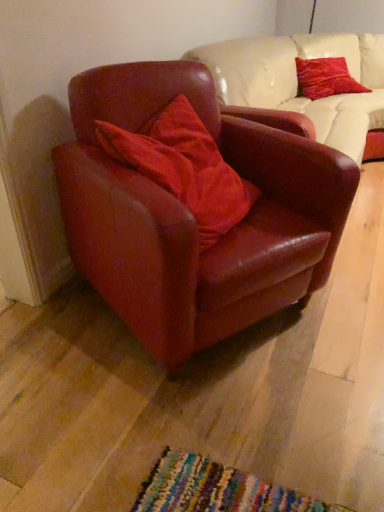
Image resolution: width=384 pixels, height=512 pixels. Describe the element at coordinates (184, 167) in the screenshot. I see `satin red pillow at center, which is the 1th pillow in bottom-to-top order` at that location.

Consider the image. Measure the distance between point (289, 262) and camera.

The depth of point (289, 262) is 4.44 feet.

At what (x,y) coordinates should I click in order to perform the action: click on velvet red pillow at upper right, arranged as the first pillow when viewed from the top. Please return your answer as a coordinate pair (x, y). Image resolution: width=384 pixels, height=512 pixels. Looking at the image, I should click on (325, 78).

How many degrees apart are the facing directions of velvet red pillow at upper right, the 2th pillow in the left-to-right sequence, and satin burgundy armchair at center?

17.9 degrees separate the facing orientations of velvet red pillow at upper right, the 2th pillow in the left-to-right sequence, and satin burgundy armchair at center.

Which of these two, velvet red pillow at upper right, arranged as the 1th pillow when viewed from the right, or satin burgundy armchair at center, is wider?

satin burgundy armchair at center.

From a real-world perspective, who is located higher, velvet red pillow at upper right, placed as the second pillow when sorted from bottom to top, or satin burgundy armchair at center?

velvet red pillow at upper right, placed as the second pillow when sorted from bottom to top, is physically above.

Based on the photo, which object is positioned more to the right, velvet red pillow at upper right, the second pillow in the front-to-back sequence, or satin burgundy armchair at center?

velvet red pillow at upper right, the second pillow in the front-to-back sequence.

From the image's perspective, which is above, velvet red pillow at upper right, the second pillow in the front-to-back sequence, or satin red pillow at center, which appears as the 2th pillow when viewed from the right?

From the image's view, velvet red pillow at upper right, the second pillow in the front-to-back sequence, is above.

Is velvet red pillow at upper right, the second pillow in the front-to-back sequence, oriented towards satin red pillow at center, the second pillow positioned from the back?

No, velvet red pillow at upper right, the second pillow in the front-to-back sequence, is not turned towards satin red pillow at center, the second pillow positioned from the back.

Which is more to the left, velvet red pillow at upper right, the 2th pillow in the left-to-right sequence, or satin red pillow at center, placed as the first pillow when sorted from left to right?

satin red pillow at center, placed as the first pillow when sorted from left to right, is more to the left.

Would you say velvet red pillow at upper right, the second pillow in the front-to-back sequence, is outside satin red pillow at center, which is the 1th pillow in bottom-to-top order?

That's correct, velvet red pillow at upper right, the second pillow in the front-to-back sequence, is outside of satin red pillow at center, which is the 1th pillow in bottom-to-top order.

Can you see satin red pillow at center, placed as the first pillow when sorted from left to right, touching satin burgundy armchair at center?

They are not placed beside each other.

Is point (222, 232) closer or farther from the camera than point (293, 206)?

Point (222, 232) is closer to the camera than point (293, 206).

Is satin red pillow at center, the second pillow viewed from the top, looking in the opposite direction of satin burgundy armchair at center?

That's right, satin red pillow at center, the second pillow viewed from the top, is facing away from satin burgundy armchair at center.

Considering the relative sizes of satin red pillow at center, which is the 1th pillow in bottom-to-top order, and satin burgundy armchair at center in the image provided, is satin red pillow at center, which is the 1th pillow in bottom-to-top order, thinner than satin burgundy armchair at center?

Yes, satin red pillow at center, which is the 1th pillow in bottom-to-top order, is thinner than satin burgundy armchair at center.

Looking at this image, considering the positions of objects satin burgundy armchair at center and velvet red pillow at upper right, arranged as the 1th pillow when viewed from the right, in the image provided, who is more to the left, satin burgundy armchair at center or velvet red pillow at upper right, arranged as the 1th pillow when viewed from the right,?

Positioned to the left is satin burgundy armchair at center.

Is satin burgundy armchair at center located outside velvet red pillow at upper right, the 1th pillow viewed from the back?

Yes, satin burgundy armchair at center is outside of velvet red pillow at upper right, the 1th pillow viewed from the back.

What's the angular difference between satin burgundy armchair at center and velvet red pillow at upper right, placed as the second pillow when sorted from bottom to top,'s facing directions?

The angle between the facing direction of satin burgundy armchair at center and the facing direction of velvet red pillow at upper right, placed as the second pillow when sorted from bottom to top, is 17.9 degrees.

In the scene shown: From the image's perspective, between satin burgundy armchair at center and satin red pillow at center, the second pillow viewed from the top, who is located below?

satin burgundy armchair at center, from the image's perspective.

Which object is thinner, satin burgundy armchair at center or satin red pillow at center, placed as the first pillow when sorted from left to right?

Thinner between the two is satin red pillow at center, placed as the first pillow when sorted from left to right.

Is satin burgundy armchair at center positioned with its back to satin red pillow at center, placed as the first pillow when sorted from left to right?

Result: Yes, satin burgundy armchair at center is facing away from satin red pillow at center, placed as the first pillow when sorted from left to right.

How many degrees apart are the facing directions of satin burgundy armchair at center and satin red pillow at center, which is the 1th pillow in front-to-back order?

The facing directions of satin burgundy armchair at center and satin red pillow at center, which is the 1th pillow in front-to-back order, are 19 degrees apart.

Is satin red pillow at center, placed as the first pillow when sorted from left to right, not inside velvet red pillow at upper right, the second pillow in the front-to-back sequence?

satin red pillow at center, placed as the first pillow when sorted from left to right, lies outside velvet red pillow at upper right, the second pillow in the front-to-back sequence,'s area.

Where is `pillow lying above the satin red pillow at center, placed as the first pillow when sorted from left to right (from the image's perspective)`? pillow lying above the satin red pillow at center, placed as the first pillow when sorted from left to right (from the image's perspective) is located at coordinates [325, 78].

From the image's perspective, which is below, satin red pillow at center, which is the 1th pillow in front-to-back order, or velvet red pillow at upper right, arranged as the first pillow when viewed from the top?

satin red pillow at center, which is the 1th pillow in front-to-back order.

Which object is more forward, satin red pillow at center, the second pillow viewed from the top, or velvet red pillow at upper right, the 2th pillow in the left-to-right sequence?

satin red pillow at center, the second pillow viewed from the top, is more forward.

You are a GUI agent. You are given a task and a screenshot of the screen. Output one action in this format:
    pyautogui.click(x=<x>, y=<y>)
    Task: Click on the 2nd pillow above the satin burgundy armchair at center (from the image's perspective)
    The height and width of the screenshot is (512, 384).
    Given the screenshot: What is the action you would take?
    pyautogui.click(x=325, y=78)

Locate an element on the screen. The image size is (384, 512). pillow below the satin red pillow at center, the second pillow viewed from the top (from a real-world perspective) is located at coordinates (325, 78).

From the image, which object appears to be nearer to satin red pillow at center, which is the 1th pillow in front-to-back order, satin burgundy armchair at center or velvet red pillow at upper right, arranged as the 1th pillow when viewed from the right?

Based on the image, satin burgundy armchair at center appears to be nearer to satin red pillow at center, which is the 1th pillow in front-to-back order.

Looking at the image, which one is located further to velvet red pillow at upper right, the second pillow in the front-to-back sequence, satin red pillow at center, which appears as the 2th pillow when viewed from the right, or satin burgundy armchair at center?

satin burgundy armchair at center is further to velvet red pillow at upper right, the second pillow in the front-to-back sequence.

From the image, which object appears to be nearer to velvet red pillow at upper right, placed as the second pillow when sorted from bottom to top, satin burgundy armchair at center or satin red pillow at center, the second pillow positioned from the back?

Based on the image, satin red pillow at center, the second pillow positioned from the back, appears to be nearer to velvet red pillow at upper right, placed as the second pillow when sorted from bottom to top.

Consider the image. From the image, which object appears to be nearer to satin burgundy armchair at center, velvet red pillow at upper right, the second pillow in the front-to-back sequence, or satin red pillow at center, which appears as the 2th pillow when viewed from the right?

The object closer to satin burgundy armchair at center is satin red pillow at center, which appears as the 2th pillow when viewed from the right.

Based on their spatial positions, is satin red pillow at center, the second pillow viewed from the top, or velvet red pillow at upper right, the second pillow in the front-to-back sequence, closer to satin burgundy armchair at center?

Based on the image, satin red pillow at center, the second pillow viewed from the top, appears to be nearer to satin burgundy armchair at center.

Estimate the real-world distances between objects in this image. Which object is further from satin red pillow at center, placed as the first pillow when sorted from left to right, velvet red pillow at upper right, arranged as the 1th pillow when viewed from the right, or satin burgundy armchair at center?

velvet red pillow at upper right, arranged as the 1th pillow when viewed from the right, lies further to satin red pillow at center, placed as the first pillow when sorted from left to right, than the other object.

Identify the location of pillow between satin burgundy armchair at center and velvet red pillow at upper right, arranged as the first pillow when viewed from the top, from front to back. Image resolution: width=384 pixels, height=512 pixels. (184, 167).